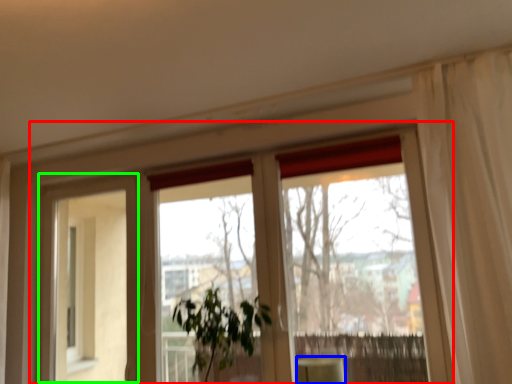
Question: Which object is positioned closest to window (highlighted by a red box)? Select from furniture (highlighted by a blue box) and screen door (highlighted by a green box).

Choices:
 (A) furniture
 (B) screen door

Answer: (B)